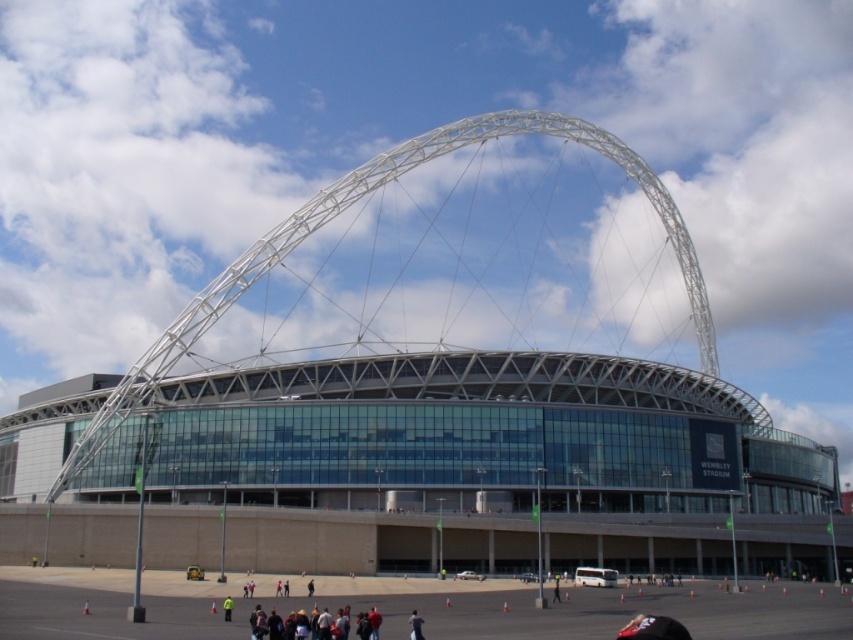
In the scene shown: You are standing in front of Wembley Stadium and notice two points marked on the facade. The first point is at coordinates point (338, 625) and the second is at point (412, 625). Which of these points is nearer to you?

Point (338, 625) is closer to the viewer than point (412, 625).

You are a security guard at Wembley Stadium and need to walk from the dark gray fabric group at lower center to the dark brown leather jacket at lower center. Your walkie talkie has a range of 5 meters. Will you lose connection while moving between them?

The distance between the dark gray fabric group at lower center and the dark brown leather jacket at lower center is 5.14 meters, which exceeds the walkie talkie range of 5 meters. Therefore, you will lose connection while moving between them.